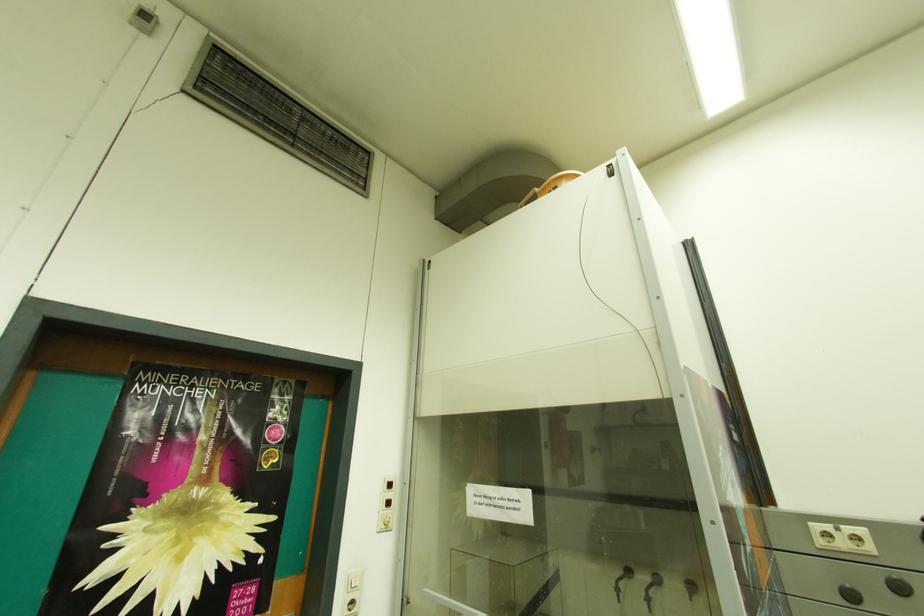
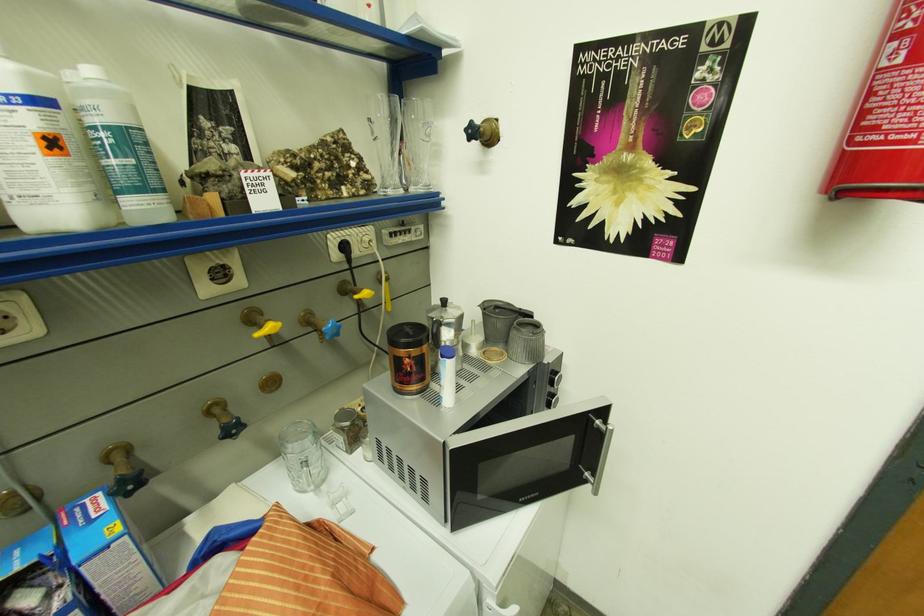
Based on the continuous images, in which direction is the camera rotating?

The camera rotated toward left-down.